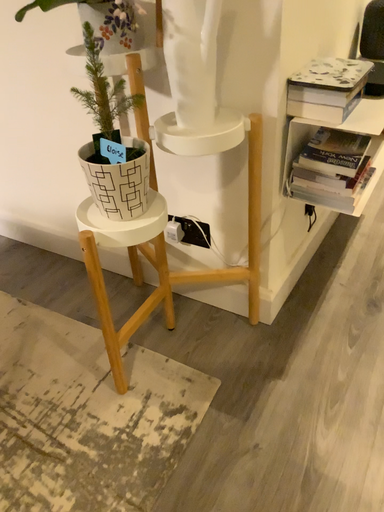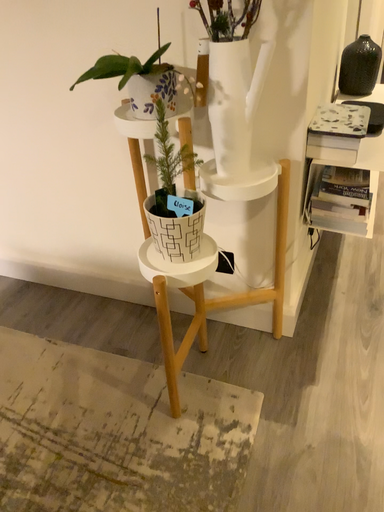
Question: How did the camera likely rotate when shooting the video?

Choices:
 (A) rotated left
 (B) rotated right

Answer: (B)